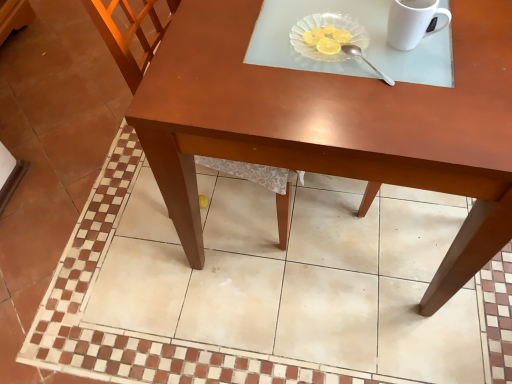
Image resolution: width=512 pixels, height=384 pixels. Identify the location of free space behind silver metallic spoon at upper center. (340, 23).